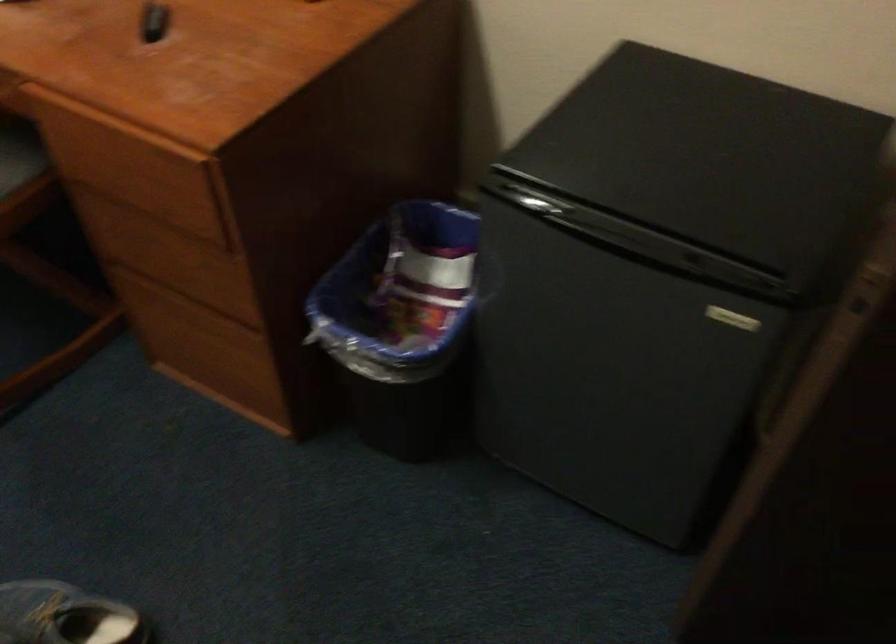
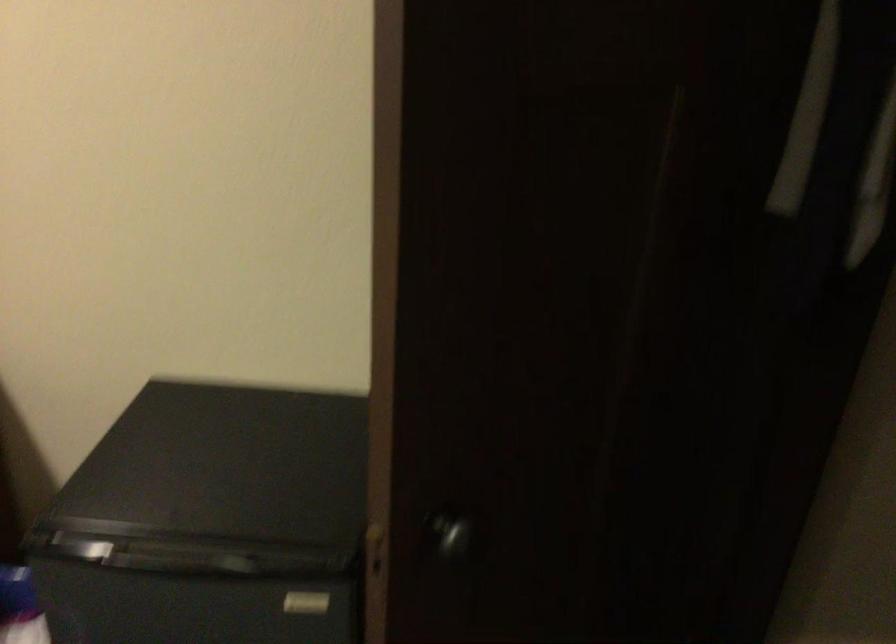
First-person continuous shooting, in which direction is the camera rotating?

The camera's rotation is toward right-up.